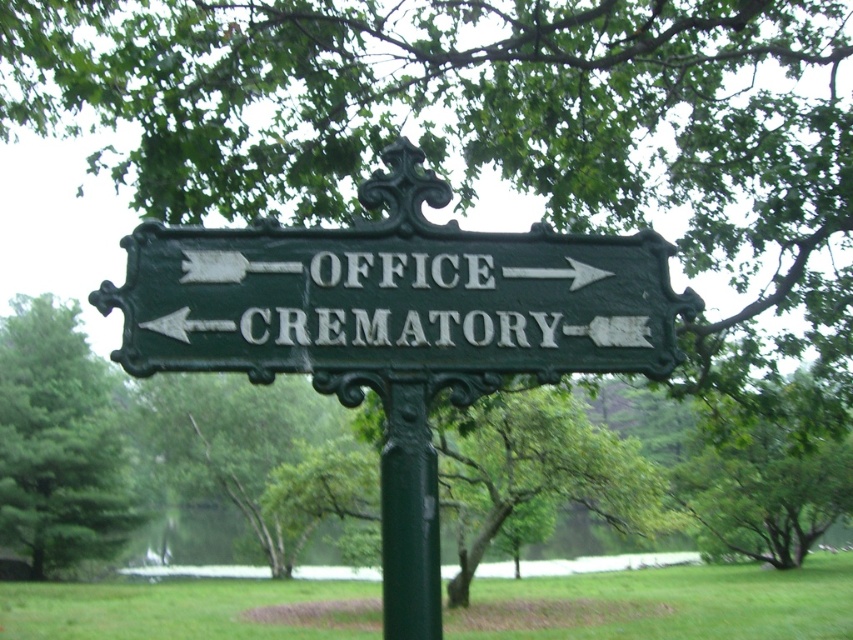
Which is behind, point (334, 264) or point (73, 470)?

Positioned behind is point (73, 470).

Where is `green cast iron sign at center`? Image resolution: width=853 pixels, height=640 pixels. green cast iron sign at center is located at coordinates (395, 298).

Does green leafy tree at left have a smaller size compared to green matte pole at center?

No, green leafy tree at left is not smaller than green matte pole at center.

What do you see at coordinates (57, 442) in the screenshot? The height and width of the screenshot is (640, 853). I see `green leafy tree at left` at bounding box center [57, 442].

This screenshot has height=640, width=853. Describe the element at coordinates (57, 442) in the screenshot. I see `green leafy tree at left` at that location.

The height and width of the screenshot is (640, 853). I want to click on green leafy tree at left, so click(x=57, y=442).

This screenshot has width=853, height=640. What do you see at coordinates (395, 298) in the screenshot?
I see `green cast iron sign at center` at bounding box center [395, 298].

Is green cast iron sign at center below green matte pole at center?

No.

Who is more forward, (x=248, y=358) or (x=395, y=548)?

Positioned in front is point (x=395, y=548).

The width and height of the screenshot is (853, 640). I want to click on green cast iron sign at center, so click(395, 298).